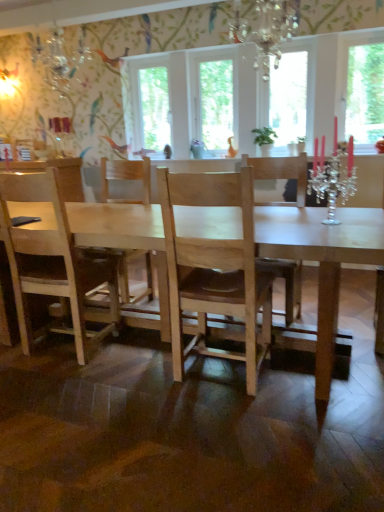
Locate an element on the screen. free space above clear glass window at center, which ranks as the 4th window screen in right-to-left order (from a real-world perspective) is located at coordinates coord(144,59).